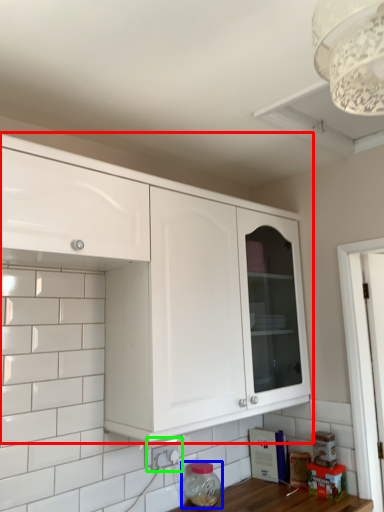
Question: Which object is the farthest from cabinetry (highlighted by a red box)? Choose among these: appliance (highlighted by a blue box) or electric outlet (highlighted by a green box).

Choices:
 (A) appliance
 (B) electric outlet

Answer: (A)